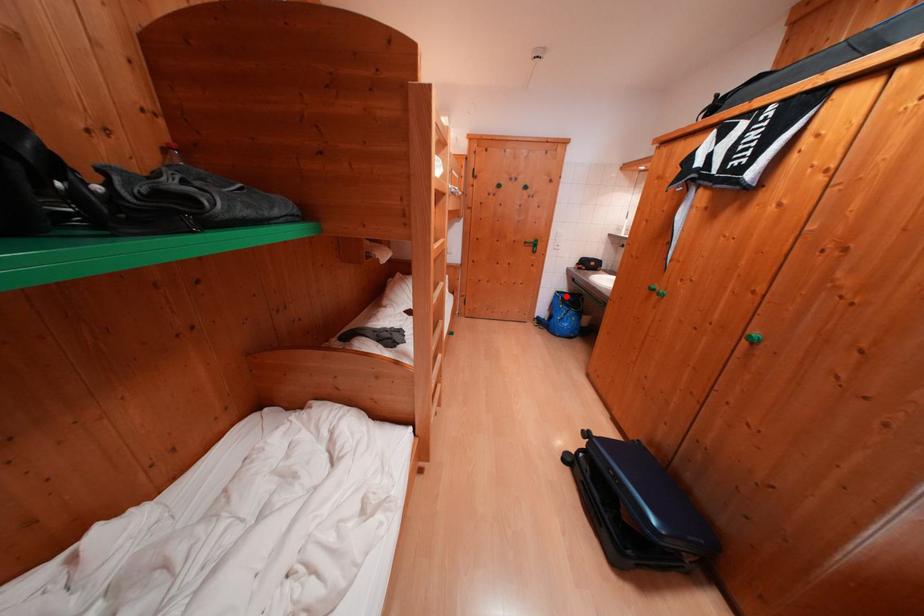
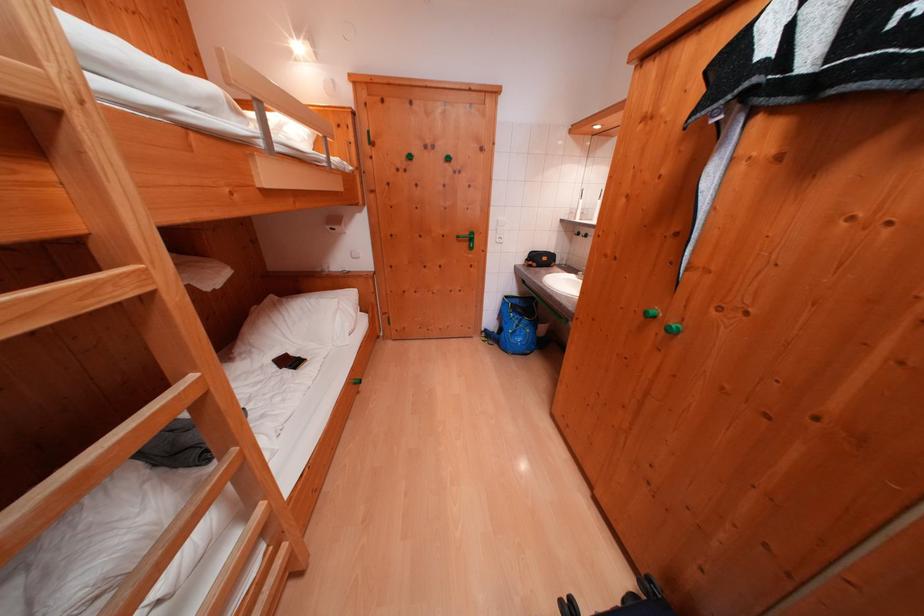
Question: I am providing you with two images of the same scene from different viewpoints. A red point is shown in image1. For the corresponding object point in image2, is it positioned nearer or farther from the camera?

Choices:
 (A) Nearer
 (B) Farther

Answer: (B)